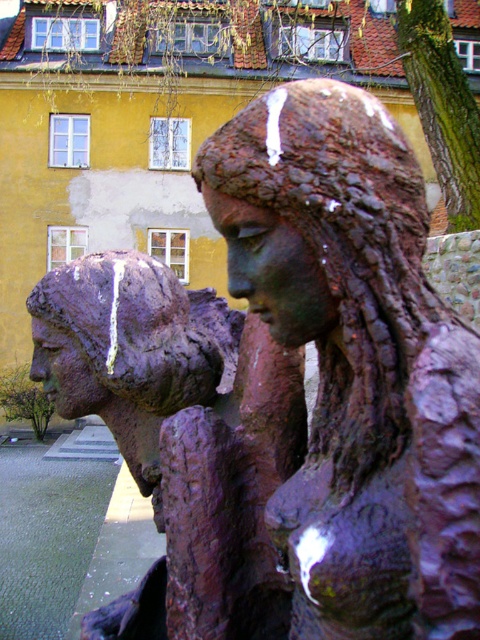
Question: Which point appears closest to the camera in this image?

Choices:
 (A) (301, 442)
 (B) (400, 189)

Answer: (B)

Question: From the image, what is the correct spatial relationship of rusty bronze statue at center in relation to rusty bronze statue at left?

Choices:
 (A) above
 (B) below

Answer: (A)

Question: Which point is farther to the camera?

Choices:
 (A) (250, 294)
 (B) (62, 275)

Answer: (B)

Question: Can you confirm if rusty bronze statue at center is positioned above rusty bronze statue at left?

Choices:
 (A) no
 (B) yes

Answer: (B)

Question: Does rusty bronze statue at center have a larger size compared to rusty bronze statue at left?

Choices:
 (A) yes
 (B) no

Answer: (B)